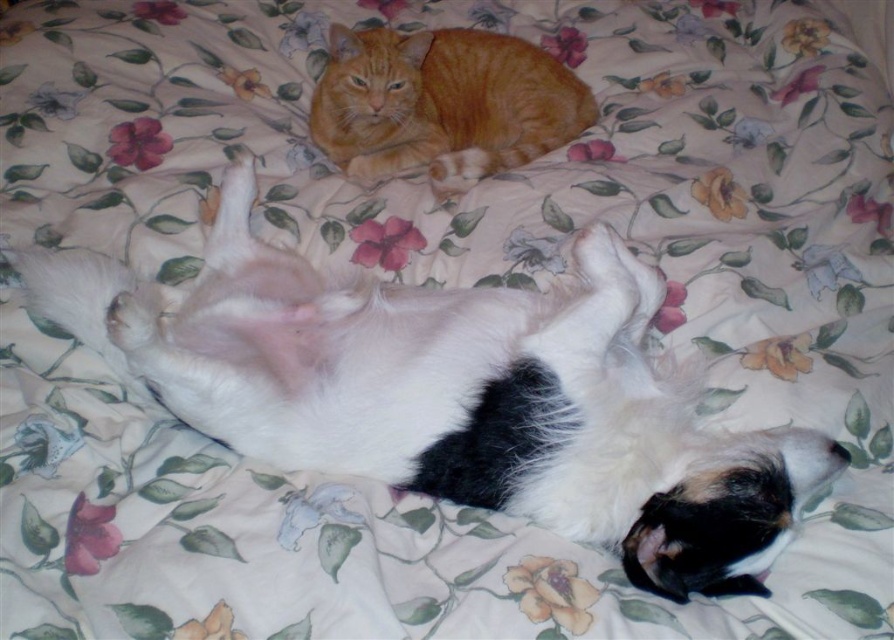
Between point (499, 497) and point (365, 90), which one is positioned behind?

Point (365, 90)

Is white soft fur cat at upper center wider than orange fur cat at upper center?

Indeed, white soft fur cat at upper center has a greater width compared to orange fur cat at upper center.

Describe the element at coordinates (453, 394) in the screenshot. I see `white soft fur cat at upper center` at that location.

Identify the location of white soft fur cat at upper center. Image resolution: width=894 pixels, height=640 pixels. pyautogui.click(x=453, y=394).